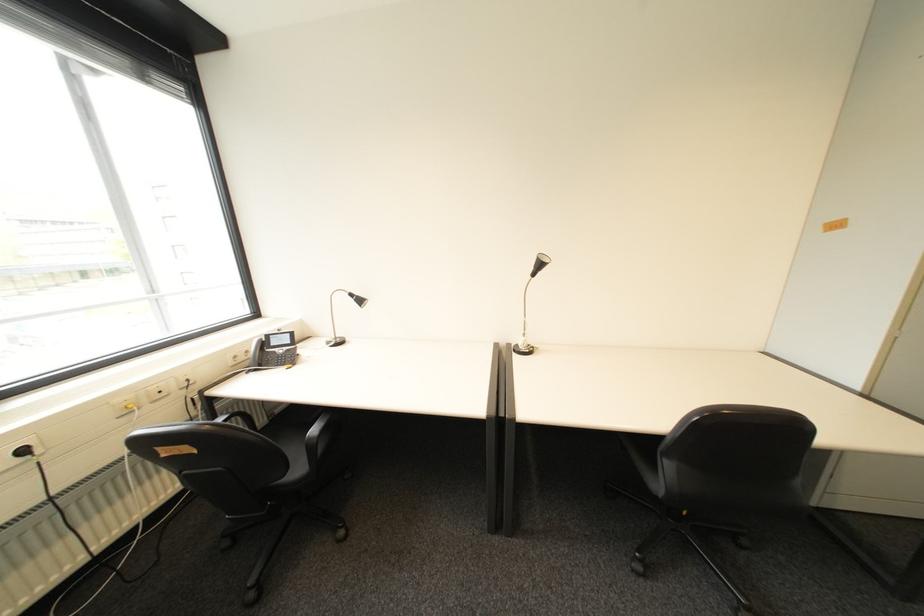
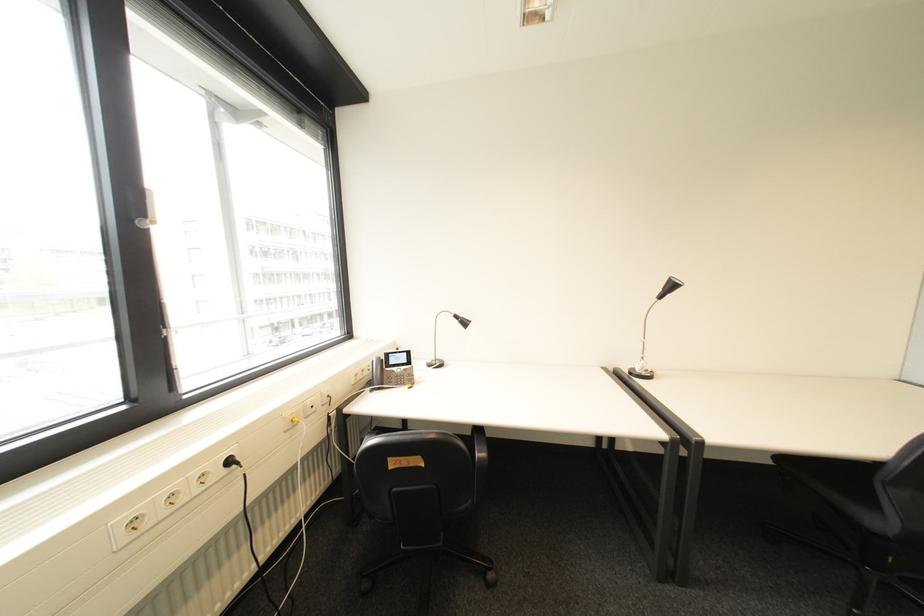
Where in the second image is the point corresponding to (277,351) from the first image?

(396, 370)